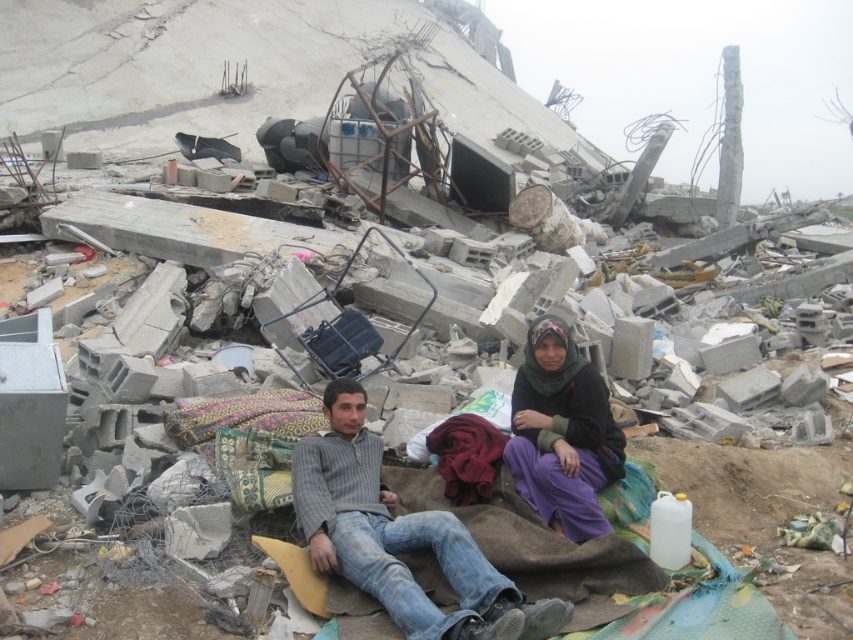
You are a photographer documenting the aftermath of a disaster. You notice two survivors wearing a gray striped sweater at center and a purple cotton dress at center. Which survivor is wearing a larger garment?

The gray striped sweater at center is bigger than the purple cotton dress at center, so the survivor wearing the gray striped sweater at center is wearing the larger garment.

You are standing at the point labeled point (498, 625) and want to move towards the point labeled point (582, 408). Which direction should you move to get closer to your destination?

You should move backward because point (498, 625) is in front of point (582, 408).

You are a rescue worker in the disaster area. You see two people sitting in the debris. The person wearing the gray striped sweater at center is 3.63 feet away from the person in the purple cotton dress at center. You need to reach both of them to provide assistance. Which direction should you approach from to ensure you can reach both without moving the debris too much?

Since the gray striped sweater at center is 3.63 feet from the purple cotton dress at center, you should approach from a direction that allows you to access both individuals within that distance, possibly from a path that is clear of major debris between them.